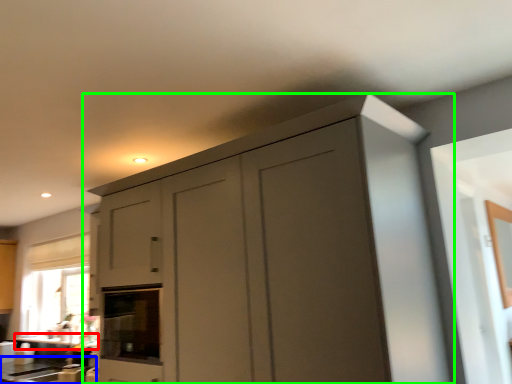
Question: Estimate the real-world distances between objects in this image. Which object is closer to counter top (highlighted by a red box), counter top (highlighted by a blue box) or cupboard (highlighted by a green box)?

Choices:
 (A) counter top
 (B) cupboard

Answer: (A)